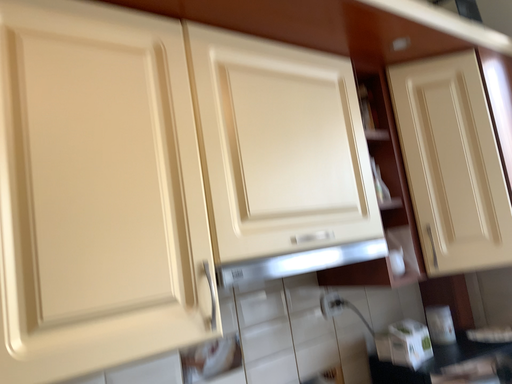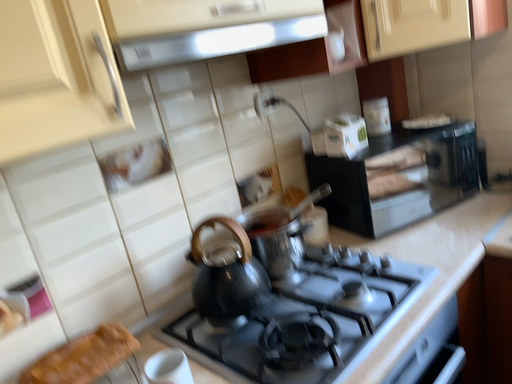
Question: How did the camera likely rotate when shooting the video?

Choices:
 (A) rotated upward
 (B) rotated downward

Answer: (B)